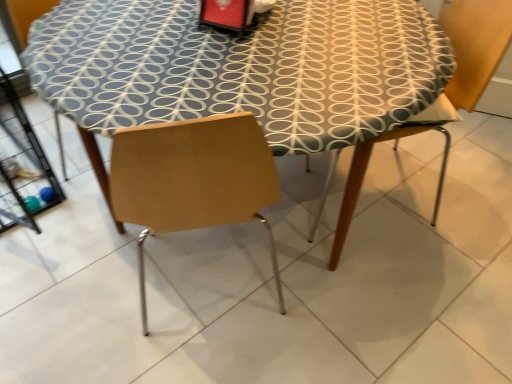
The height and width of the screenshot is (384, 512). Find the location of `patterned fabric table at center`. patterned fabric table at center is located at coordinates (246, 71).

Describe the element at coordinates (246, 71) in the screenshot. I see `patterned fabric table at center` at that location.

Describe the element at coordinates (475, 45) in the screenshot. I see `wooden chair at right` at that location.

Where is `wooden chair at right`? The width and height of the screenshot is (512, 384). wooden chair at right is located at coordinates (475, 45).

Measure the distance between point (449, 16) and camera.

Point (449, 16) and camera are 1.47 meters apart.

The image size is (512, 384). I want to click on patterned fabric table at center, so pos(246,71).

Can you confirm if patterned fabric table at center is positioned to the left of wooden chair at right?

Correct, you'll find patterned fabric table at center to the left of wooden chair at right.

Which object is more forward, patterned fabric table at center or wooden chair at right?

patterned fabric table at center is closer to the camera.

Between point (166, 87) and point (466, 56), which one is positioned in front?

The point (166, 87) is in front.

Looking at this image, from the image's perspective, is patterned fabric table at center above wooden chair at right?

Incorrect, from the image's perspective, patterned fabric table at center is lower than wooden chair at right.

From a real-world perspective, which is physically below, patterned fabric table at center or wooden chair at right?

In real-world perspective, patterned fabric table at center is lower.

Can you confirm if patterned fabric table at center is thinner than wooden chair at right?

No.

Does patterned fabric table at center have a lesser height compared to wooden chair at right?

Yes, patterned fabric table at center is shorter than wooden chair at right.

Considering the sizes of objects patterned fabric table at center and wooden chair at right in the image provided, who is smaller, patterned fabric table at center or wooden chair at right?

With smaller size is wooden chair at right.

Is patterned fabric table at center inside the boundaries of wooden chair at right, or outside?

patterned fabric table at center is located beyond the bounds of wooden chair at right.

Is patterned fabric table at center not close to wooden chair at right?

Actually, patterned fabric table at center and wooden chair at right are a little close together.

Could you tell me if patterned fabric table at center is turned towards wooden chair at right?

Yes, patterned fabric table at center is oriented towards wooden chair at right.

How much distance is there between patterned fabric table at center and wooden chair at right?

patterned fabric table at center is 15.82 inches away from wooden chair at right.

At what (x,y) coordinates should I click in order to perform the action: click on table below the wooden chair at right (from the image's perspective). Please return your answer as a coordinate pair (x, y). Image resolution: width=512 pixels, height=384 pixels. Looking at the image, I should click on (246, 71).

In the scene shown: Which is more to the right, wooden chair at right or patterned fabric table at center?

Positioned to the right is wooden chair at right.

Considering the relative positions of wooden chair at right and patterned fabric table at center in the image provided, is wooden chair at right behind patterned fabric table at center?

Yes, it is.

Is point (456, 32) less distant than point (149, 38)?

No.

Based on the photo, from the image's perspective, is wooden chair at right on top of patterned fabric table at center?

Indeed, from the image's perspective, wooden chair at right is shown above patterned fabric table at center.

From a real-world perspective, is wooden chair at right positioned above or below patterned fabric table at center?

wooden chair at right is above patterned fabric table at center.

Is wooden chair at right thinner than patterned fabric table at center?

Correct, the width of wooden chair at right is less than that of patterned fabric table at center.

Who is shorter, wooden chair at right or patterned fabric table at center?

Standing shorter between the two is patterned fabric table at center.

Which of these two, wooden chair at right or patterned fabric table at center, is bigger?

Bigger between the two is patterned fabric table at center.

Is patterned fabric table at center inside wooden chair at right?

No, patterned fabric table at center is not a part of wooden chair at right.

Is wooden chair at right not close to patterned fabric table at center?

Actually, wooden chair at right and patterned fabric table at center are a little close together.

Is wooden chair at right facing towards patterned fabric table at center?

Yes, wooden chair at right faces towards patterned fabric table at center.

The height and width of the screenshot is (384, 512). There is a patterned fabric table at center. What are the coordinates of `chair above it (from a real-world perspective)` in the screenshot? It's located at (475, 45).

There is a patterned fabric table at center. At what (x,y) coordinates should I click in order to perform the action: click on chair above it (from a real-world perspective). Please return your answer as a coordinate pair (x, y). This screenshot has width=512, height=384. Looking at the image, I should click on (475, 45).

This screenshot has width=512, height=384. I want to click on table below the wooden chair at right (from a real-world perspective), so click(x=246, y=71).